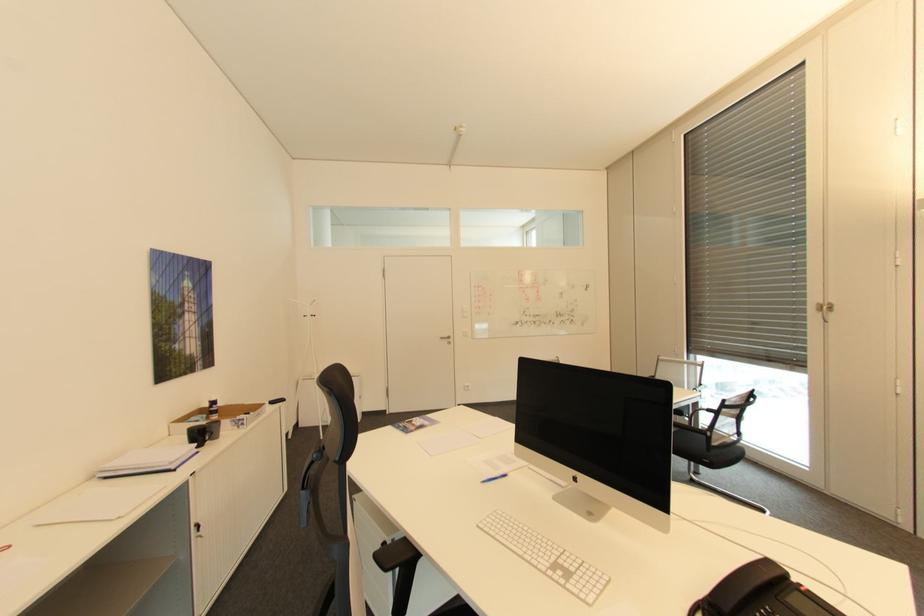
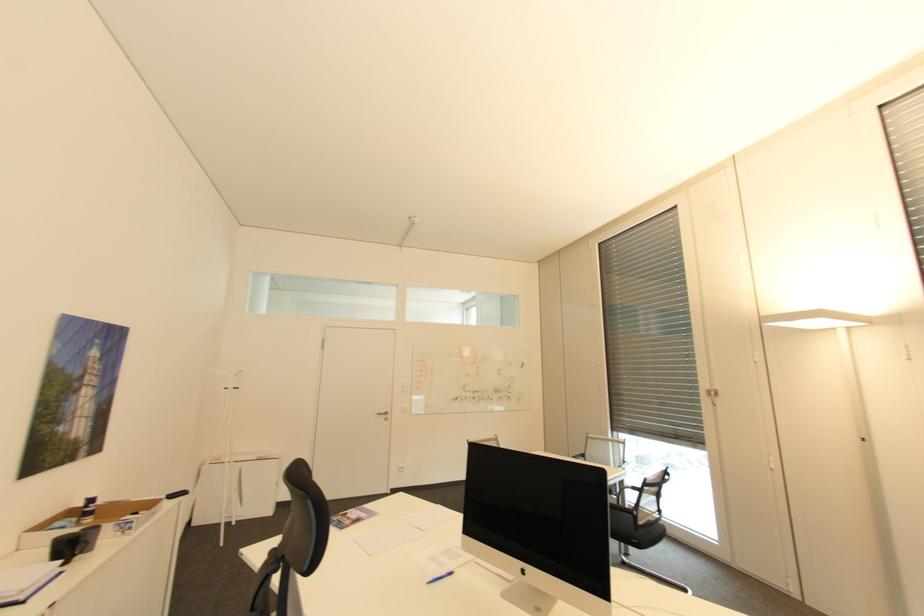
Find the pixel in the second image that matches pixel 828 302 in the first image.

(713, 387)